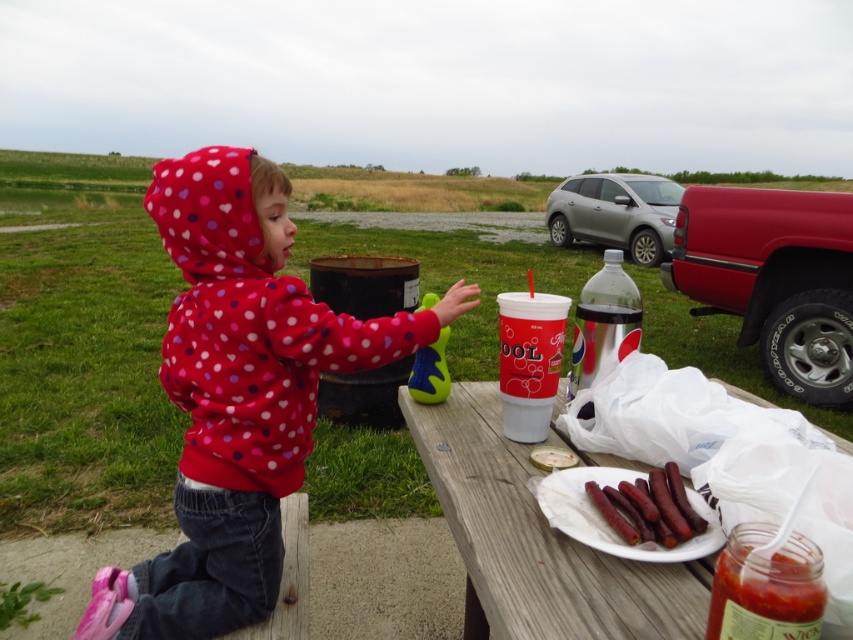
You are standing at the camera position and want to place a 24 inch long object on the ground between you and the wooden picnic table at lower center. Is there enough space to place it without it overlapping with the table?

The distance between the camera and the wooden picnic table at lower center is 26.33 inches. Since the object is only 24 inches long, there is enough space to place it between you and the table without overlapping.

You are a photographer trying to take a picture of the polka dot fleece hoodie at center. The camera is 1.18 meters away from the hoodie. If your camera has a minimum focusing distance of 1.2 meters, will you be able to take a clear photo?

The polka dot fleece hoodie at center and camera are 1.18 meters apart from each other. Since the minimum focusing distance is 1.2 meters, the camera cannot focus properly at 1.18 meters, so you won cannot take a clear photo.